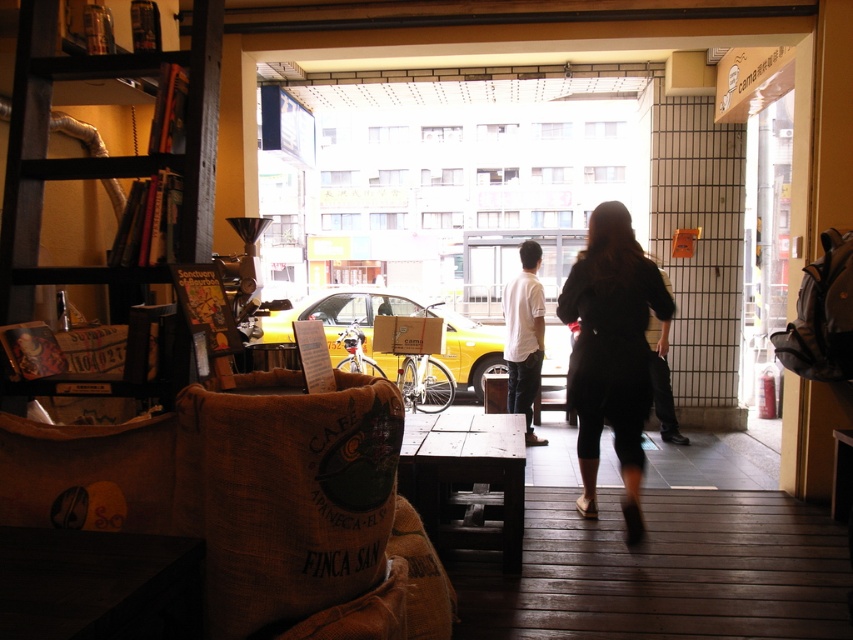
Consider the image. You are a customer at the cozy cafe and want to step outside to the yellow taxi parked outside. You are currently standing at the center of the cafe. The white cotton shirt at center and black leather pants at center are blocking your path. How far apart are these two items to ensure you can pass through?

The white cotton shirt at center is 37.37 inches from black leather pants at center, so you can pass through the path between them as the distance is sufficient for a person to walk through.

You are standing inside the cozy cafe looking out through the open doorway. You notice two points marked in the image. Which of the two points, point (509, 358) or point (656, 330), is closer to you?

Point (509, 358) is closer to the viewer than point (656, 330).

You are a customer entering the cozy cafe and see both the burlap sack at center and the black fabric dress at center. Which object is smaller in size?

The burlap sack at center is smaller in size compared to the black fabric dress at center.